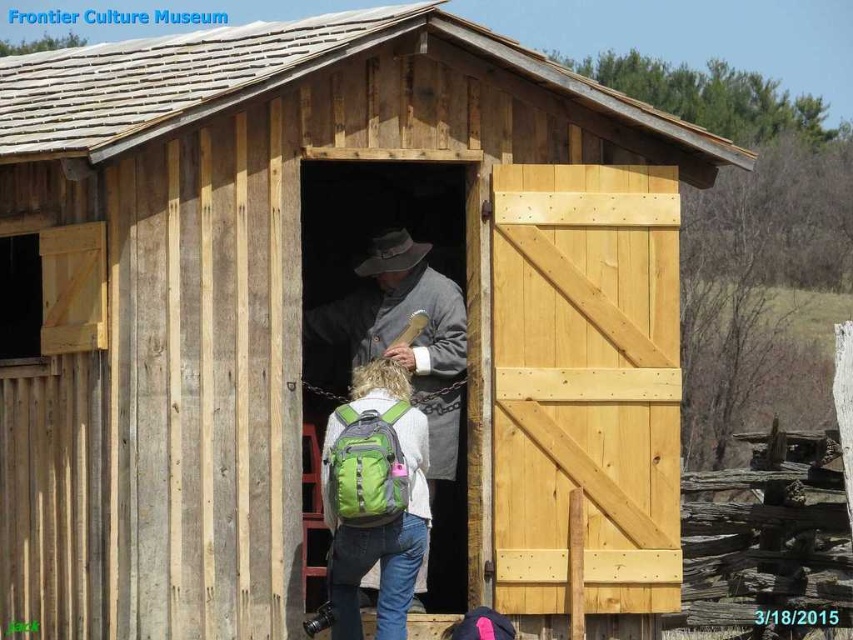
Question: Which object is closer to the camera taking this photo?

Choices:
 (A) gray woolen coat at center
 (B) natural wood barn door at right
 (C) green fabric backpack at center

Answer: (C)

Question: Which point is farther from the camera taking this photo?

Choices:
 (A) (434, 422)
 (B) (494, 451)

Answer: (A)

Question: Is natural wood barn door at right thinner than gray woolen coat at center?

Choices:
 (A) yes
 (B) no

Answer: (B)

Question: Can you confirm if natural wood barn door at right is bigger than green fabric backpack at center?

Choices:
 (A) no
 (B) yes

Answer: (B)

Question: Does natural wood barn door at right appear on the right side of green fabric backpack at center?

Choices:
 (A) yes
 (B) no

Answer: (A)

Question: Which point is farther from the camera taking this photo?

Choices:
 (A) (340, 324)
 (B) (408, 488)
 (C) (643, 321)

Answer: (A)